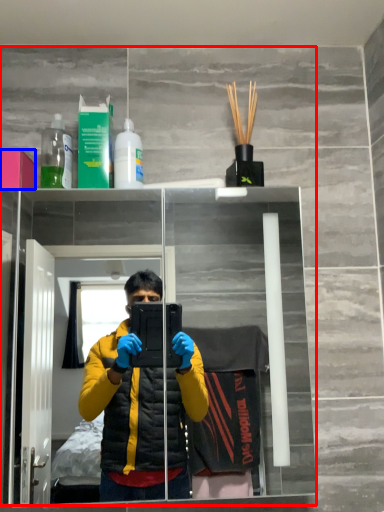
Question: Which of the following is the farthest to the observer, mirror (highlighted by a red box) or box (highlighted by a blue box)?

Choices:
 (A) mirror
 (B) box

Answer: (B)